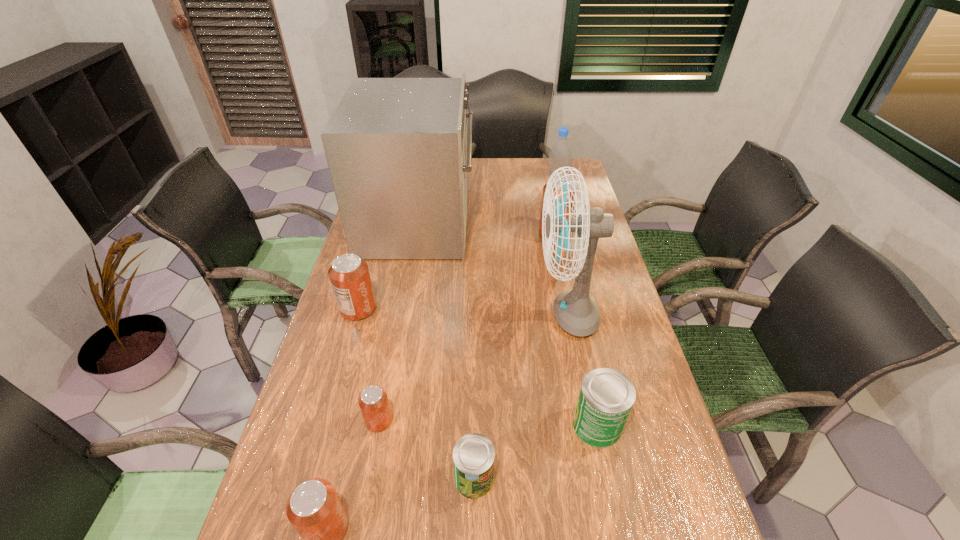
Locate an element on the screen. This screenshot has width=960, height=540. vacant space at the left edge is located at coordinates (378, 281).

Locate an element on the screen. free space at the right edge is located at coordinates (605, 296).

Image resolution: width=960 pixels, height=540 pixels. What are the coordinates of `vacant area that lies between the toaster oven and the third farthest orange can` in the screenshot? It's located at (399, 321).

At what (x,y) coordinates should I click in order to perform the action: click on unoccupied position between the toaster oven and the farthest object. Please return your answer as a coordinate pair (x, y). This screenshot has height=540, width=960. Looking at the image, I should click on (488, 201).

Locate an element on the screen. The image size is (960, 540). vacant region between the toaster oven and the fan is located at coordinates (493, 268).

Locate an element on the screen. This screenshot has width=960, height=540. unoccupied area between the toaster oven and the rightmost orange can is located at coordinates (488, 228).

Image resolution: width=960 pixels, height=540 pixels. Identify the location of free space between the toaster oven and the rightmost orange can. (488, 228).

I want to click on vacant point located between the gray bottle and the third farthest orange can, so click(468, 300).

Where is `vacant space that's between the third farthest orange can and the rightmost orange can`? The image size is (960, 540). vacant space that's between the third farthest orange can and the rightmost orange can is located at coordinates (468, 328).

Find the location of `the closest object to the second biggest orange can`. the closest object to the second biggest orange can is located at coordinates pos(397,151).